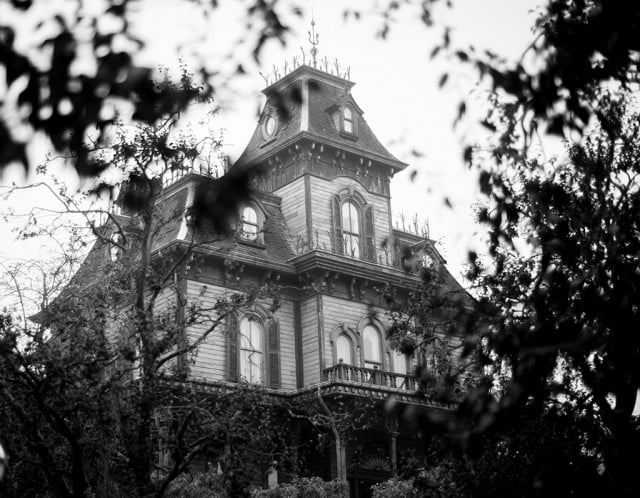
You are a GUI agent. You are given a task and a screenshot of the screen. Output one action in this format:
    pyautogui.click(x=<x>, y=<y>)
    Task: Click on the column
    This screenshot has width=640, height=498.
    Given the screenshot: What is the action you would take?
    pyautogui.click(x=342, y=462), pyautogui.click(x=396, y=444)